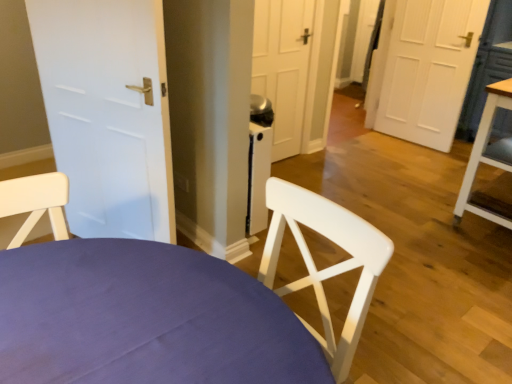
Question: Considering the relative positions of white matte door at left and wooden table at right in the image provided, is white matte door at left to the right of wooden table at right from the viewer's perspective?

Choices:
 (A) yes
 (B) no

Answer: (B)

Question: Is the position of white matte door at left more distant than that of wooden table at right?

Choices:
 (A) yes
 (B) no

Answer: (B)

Question: Is white matte door at left facing away from wooden table at right?

Choices:
 (A) yes
 (B) no

Answer: (B)

Question: Is white matte door at left not inside wooden table at right?

Choices:
 (A) yes
 (B) no

Answer: (A)

Question: Is white matte door at left to the left of wooden table at right from the viewer's perspective?

Choices:
 (A) yes
 (B) no

Answer: (A)

Question: Is point (78, 216) positioned closer to the camera than point (15, 319)?

Choices:
 (A) farther
 (B) closer

Answer: (A)

Question: In terms of width, does white matte door at left look wider or thinner when compared to white wood chair at center?

Choices:
 (A) wide
 (B) thin

Answer: (B)

Question: From a real-world perspective, is white matte door at left physically located above or below white wood chair at center?

Choices:
 (A) above
 (B) below

Answer: (A)

Question: From the image's perspective, is white matte door at left above or below white wood chair at center?

Choices:
 (A) below
 (B) above

Answer: (B)

Question: Relative to white matte door at left, is wooden table at right in front or behind?

Choices:
 (A) front
 (B) behind

Answer: (B)

Question: Do you think wooden table at right is within white matte door at left, or outside of it?

Choices:
 (A) outside
 (B) inside

Answer: (A)

Question: In the image, is wooden table at right on the left side or the right side of white matte door at left?

Choices:
 (A) left
 (B) right

Answer: (B)

Question: In terms of height, does wooden table at right look taller or shorter compared to white matte door at left?

Choices:
 (A) tall
 (B) short

Answer: (B)

Question: From the image's perspective, is white wood chair at center positioned above or below white matte door at left?

Choices:
 (A) below
 (B) above

Answer: (A)

Question: Is white wood chair at center bigger or smaller than white matte door at left?

Choices:
 (A) big
 (B) small

Answer: (A)